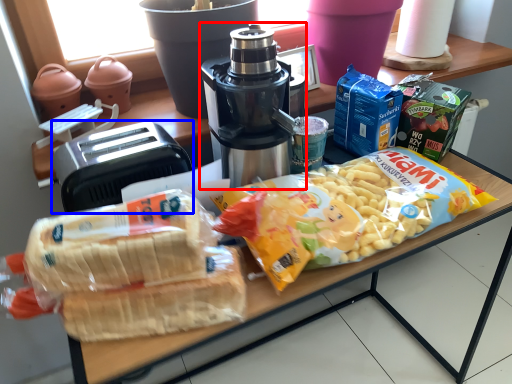
Question: Which point is closer to the camera, coffee maker (highlighted by a red box) or toaster (highlighted by a blue box)?

Choices:
 (A) coffee maker
 (B) toaster

Answer: (A)